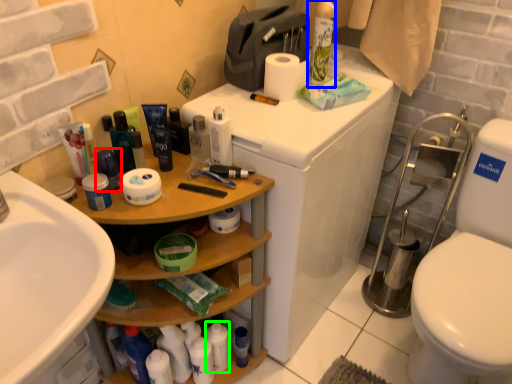
Question: Based on their relative distances, which object is farther from toiletry (highlighted by a red box)? Choose from cleaning product (highlighted by a blue box) and toiletry (highlighted by a green box).

Choices:
 (A) cleaning product
 (B) toiletry

Answer: (A)